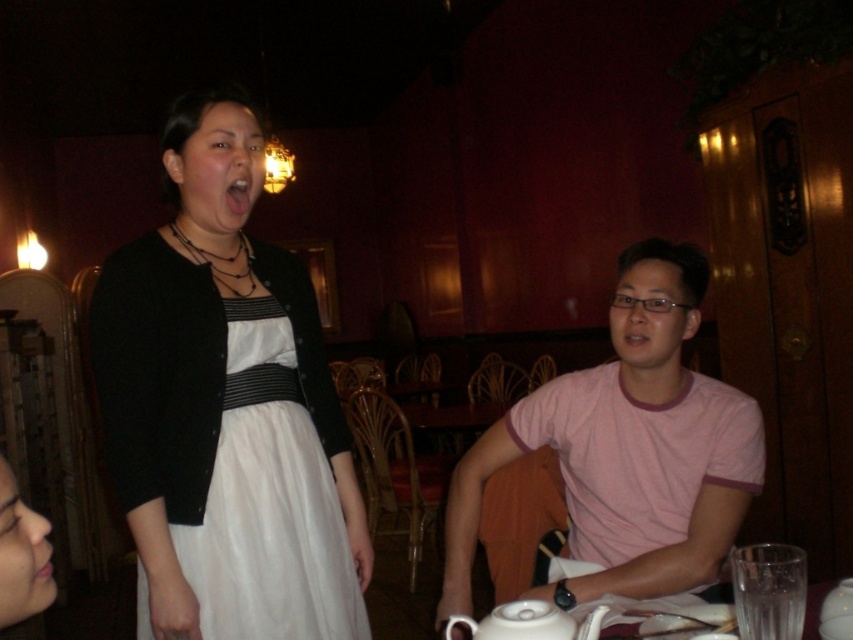
Between point (544, 522) and point (50, 556), which one is positioned behind?

Positioned behind is point (544, 522).

Is point (483, 452) in front of point (33, 570)?

No, it is behind (33, 570).

Does point (724, 413) come behind point (45, 580)?

Yes, point (724, 413) is farther from viewer.

Identify the location of pink cotton shirt at right. (614, 458).

Does white glossy teapot at lower center appear under pink matte flesh at lower left?

Correct, white glossy teapot at lower center is located below pink matte flesh at lower left.

Who is more forward, (517, 605) or (39, 557)?

Point (39, 557) is more forward.

Between point (556, 636) and point (33, 548), which one is positioned in front?

Positioned in front is point (33, 548).

What are the coordinates of `white glossy teapot at lower center` in the screenshot? It's located at (527, 621).

Who is positioned more to the right, pink cotton shirt at right or pink glossy lips at center?

From the viewer's perspective, pink cotton shirt at right appears more on the right side.

Is point (689, 556) closer to camera compared to point (239, 216)?

Yes, it is.

Image resolution: width=853 pixels, height=640 pixels. In order to click on pink cotton shirt at right in this screenshot , I will do `click(614, 458)`.